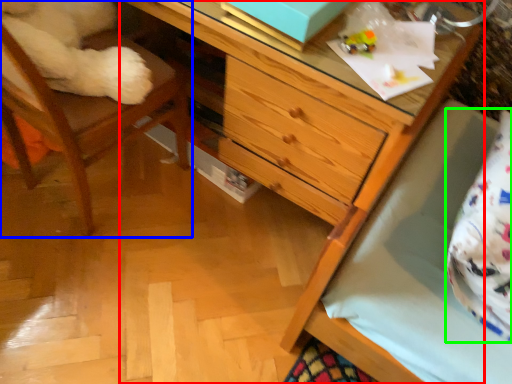
Question: Based on their relative distances, which object is nearer to chest of drawers (highlighted by a red box)? Choose from chair (highlighted by a blue box) and pillow (highlighted by a green box).

Choices:
 (A) chair
 (B) pillow

Answer: (B)